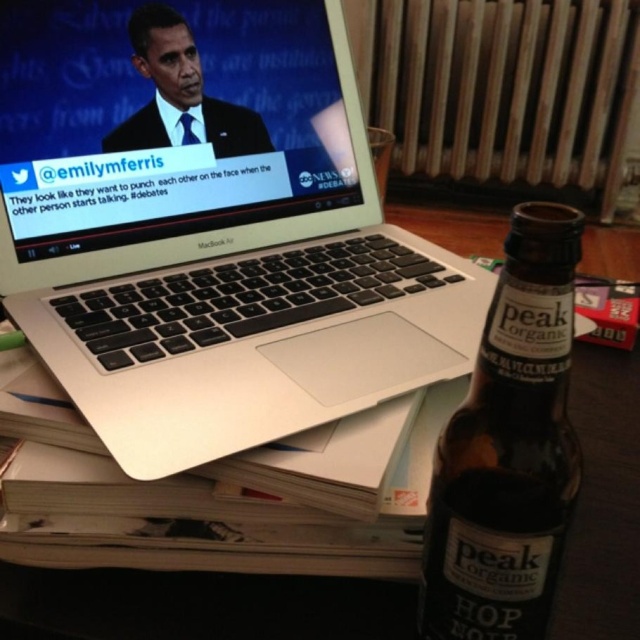
Question: Can you confirm if silver metallic laptop at upper left is positioned to the left of brown glass bottle at lower right?

Choices:
 (A) yes
 (B) no

Answer: (A)

Question: Does silver metallic laptop at upper left have a greater width compared to brown glass bottle at lower right?

Choices:
 (A) no
 (B) yes

Answer: (B)

Question: Which object is the closest to the silver metallic laptop at upper left?

Choices:
 (A) matte black laptop at upper left
 (B) smooth black suit at upper left

Answer: (A)

Question: Which point appears farthest from the camera in this image?

Choices:
 (A) (180, 90)
 (B) (333, 220)
 (C) (170, 189)
 (D) (536, 432)

Answer: (B)

Question: Estimate the real-world distances between objects in this image. Which object is closer to the matte black laptop at upper left?

Choices:
 (A) brown glass bottle at lower right
 (B) smooth black suit at upper left
 (C) silver metallic laptop at upper left

Answer: (C)

Question: Does brown glass bottle at lower right come behind smooth black suit at upper left?

Choices:
 (A) yes
 (B) no

Answer: (B)